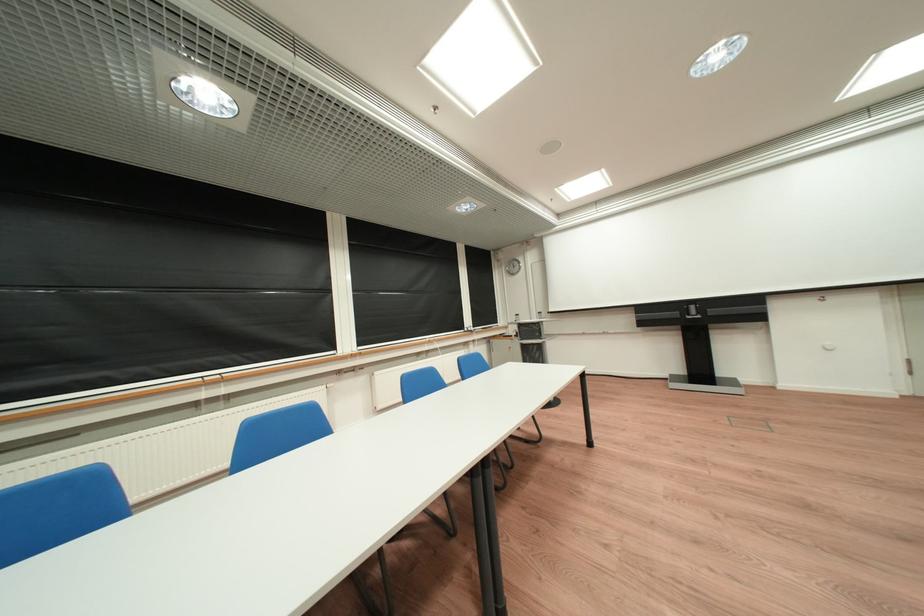
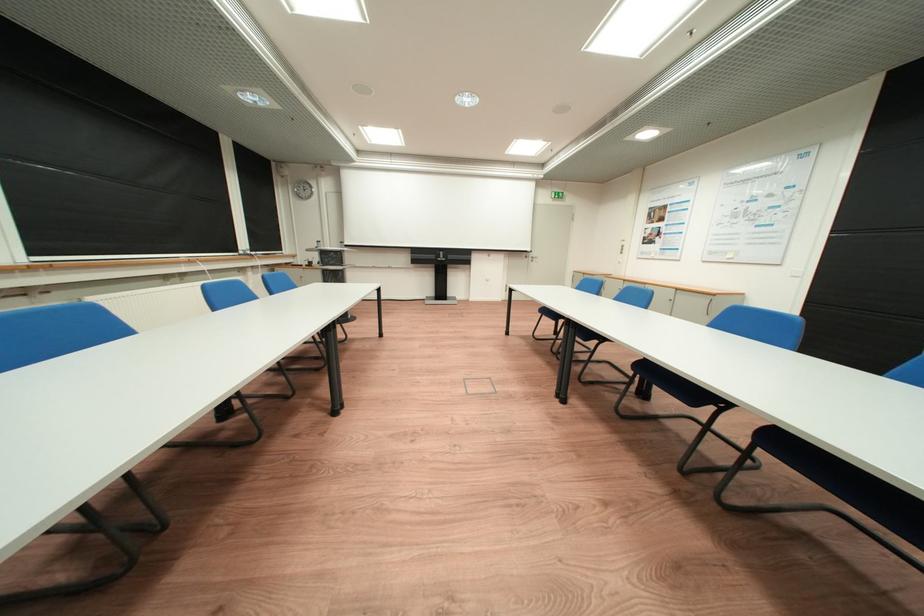
Question: I am providing you with two images of the same scene from different viewpoints. After the viewpoint changes to image2, which objects are now occluded?

Choices:
 (A) projector screen handle
 (B) blue chair sitting surface
 (C) door handle
 (D) none of these

Answer: (D)